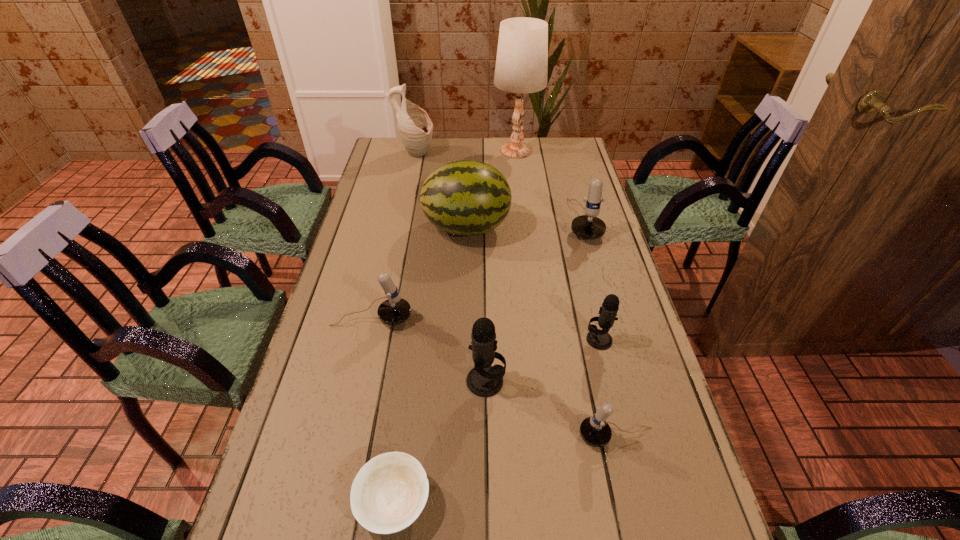
Locate an element on the screen. This screenshot has height=540, width=960. the farther black microphone is located at coordinates (599, 339).

Find the location of a particular element. The width and height of the screenshot is (960, 540). the smallest white microphone is located at coordinates (595, 431).

At what (x,y) coordinates should I click in order to perform the action: click on the nearest microphone. Please return your answer as a coordinate pair (x, y). This screenshot has height=540, width=960. Looking at the image, I should click on (595, 431).

You are a GUI agent. You are given a task and a screenshot of the screen. Output one action in this format:
    pyautogui.click(x=<x>, y=<y>)
    Task: Click on the vacant space situated 0.260m on the left of the lamp
    
    Given the screenshot: What is the action you would take?
    pyautogui.click(x=430, y=151)

Find the location of a particular element. Image resolution: width=960 pixels, height=540 pixels. free region located 0.370m at the spout of the eighth shortest object is located at coordinates (524, 154).

Image resolution: width=960 pixels, height=540 pixels. In order to click on vacant space positioned at the stem end of the green watermelon in this screenshot , I will do click(x=549, y=228).

At what (x,y) coordinates should I click in order to perform the action: click on vacant space located 0.160m on the left of the second microphone from left to right. Please return your answer as a coordinate pair (x, y). The width and height of the screenshot is (960, 540). Looking at the image, I should click on (399, 381).

Where is `vacant space located on the back of the farthest white microphone`? This screenshot has height=540, width=960. vacant space located on the back of the farthest white microphone is located at coordinates (570, 175).

The height and width of the screenshot is (540, 960). I want to click on vacant space located 0.320m on the right of the second farthest white microphone, so click(531, 318).

You are a GUI agent. You are given a task and a screenshot of the screen. Output one action in this format:
    pyautogui.click(x=<x>, y=<y>)
    Task: Click on the free region located on the front of the smaller black microphone
    The height and width of the screenshot is (540, 960).
    Given the screenshot: What is the action you would take?
    pyautogui.click(x=620, y=428)